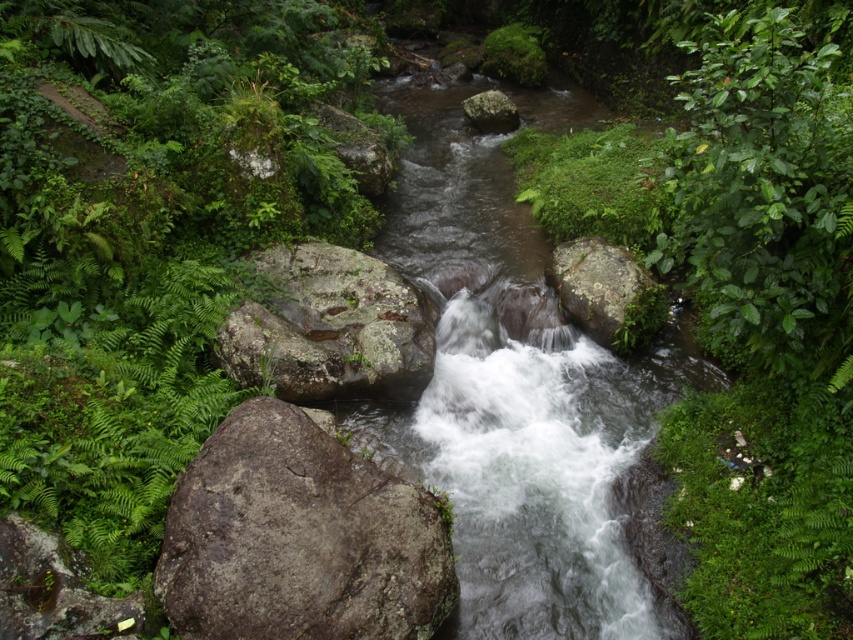
Question: Can you confirm if green mossy rock at lower left is positioned above green mossy rock at center?

Choices:
 (A) no
 (B) yes

Answer: (A)

Question: Where is green mossy rock at lower left located in relation to lichen-covered rock at center-right in the image?

Choices:
 (A) right
 (B) left

Answer: (B)

Question: Is the position of gray rough rock at lower left less distant than that of green mossy rock at lower left?

Choices:
 (A) yes
 (B) no

Answer: (B)

Question: Estimate the real-world distances between objects in this image. Which object is closer to the gray rough boulder at center?

Choices:
 (A) green mossy rock at center
 (B) gray rough rock at lower left
 (C) lichen-covered rock at center-right
 (D) green mossy rock at lower left

Answer: (B)

Question: Which object is farther from the camera taking this photo?

Choices:
 (A) gray rough boulder at center
 (B) gray rough rock at lower left
 (C) green mossy rock at center

Answer: (C)

Question: Which of the following is the closest to the observer?

Choices:
 (A) green mossy rock at center
 (B) gray rough boulder at center
 (C) lichen-covered rock at center-right
 (D) green mossy rock at lower left

Answer: (D)